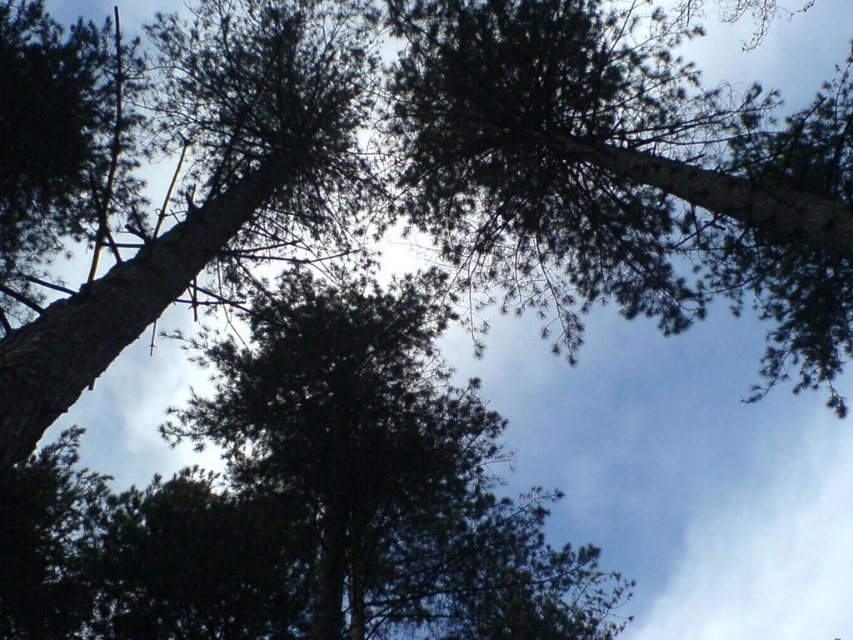
Between green needle-like at upper center and green textured tree trunk at left, which one appears on the right side from the viewer's perspective?

Positioned to the right is green needle-like at upper center.

Is point (581, 83) in front of point (222, 58)?

That is True.

Locate an element on the screen. The height and width of the screenshot is (640, 853). green needle-like at upper center is located at coordinates (631, 170).

The image size is (853, 640). In order to click on green needle-like at upper center in this screenshot , I will do `click(631, 170)`.

Is dark green textured tree at center shorter than green textured tree trunk at left?

Yes, dark green textured tree at center is shorter than green textured tree trunk at left.

The width and height of the screenshot is (853, 640). What are the coordinates of `dark green textured tree at center` in the screenshot? It's located at (390, 472).

How much distance is there between green needle-like at upper center and dark green textured tree at center?

green needle-like at upper center and dark green textured tree at center are 3.86 meters apart.

Between green needle-like at upper center and dark green textured tree at center, which one appears on the right side from the viewer's perspective?

From the viewer's perspective, green needle-like at upper center appears more on the right side.

Locate an element on the screen. The width and height of the screenshot is (853, 640). green needle-like at upper center is located at coordinates (631, 170).